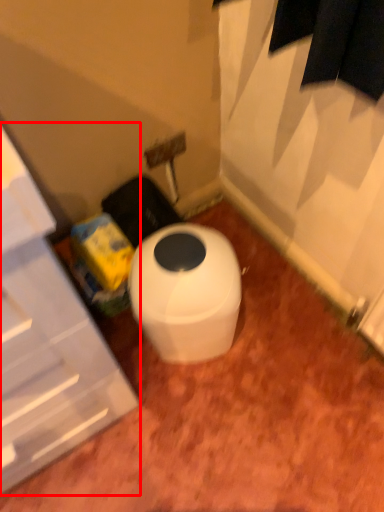
Question: From the image's perspective, where is cabinetry (annotated by the red box) located in relation to toilet in the image?

Choices:
 (A) below
 (B) above

Answer: (B)